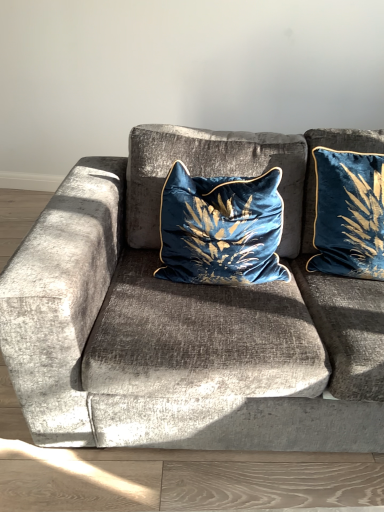
Question: Looking at their shapes, would you say velvet cushion at center is wider or thinner than velvet blue pillow at center, the 2th pillow from the right?

Choices:
 (A) wide
 (B) thin

Answer: (A)

Question: Would you say velvet cushion at center is to the left or to the right of velvet blue pillow at center, the 2th pillow from the right, in the picture?

Choices:
 (A) right
 (B) left

Answer: (A)

Question: Based on their relative distances, which object is nearer to the velvet blue pillow at upper right, which is the first pillow from right to left?

Choices:
 (A) velvet cushion at center
 (B) velvet blue pillow at center, which ranks as the 1th pillow in left-to-right order

Answer: (B)

Question: Which object is positioned closest to the velvet cushion at center?

Choices:
 (A) velvet blue pillow at center, the 2th pillow from the right
 (B) velvet blue pillow at upper right, which appears as the 2th pillow when viewed from the left

Answer: (A)